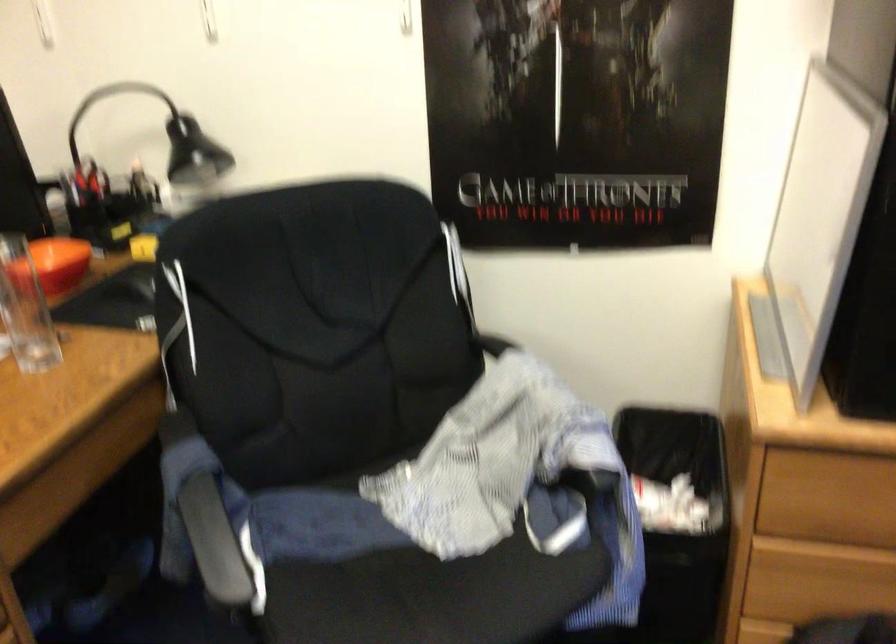
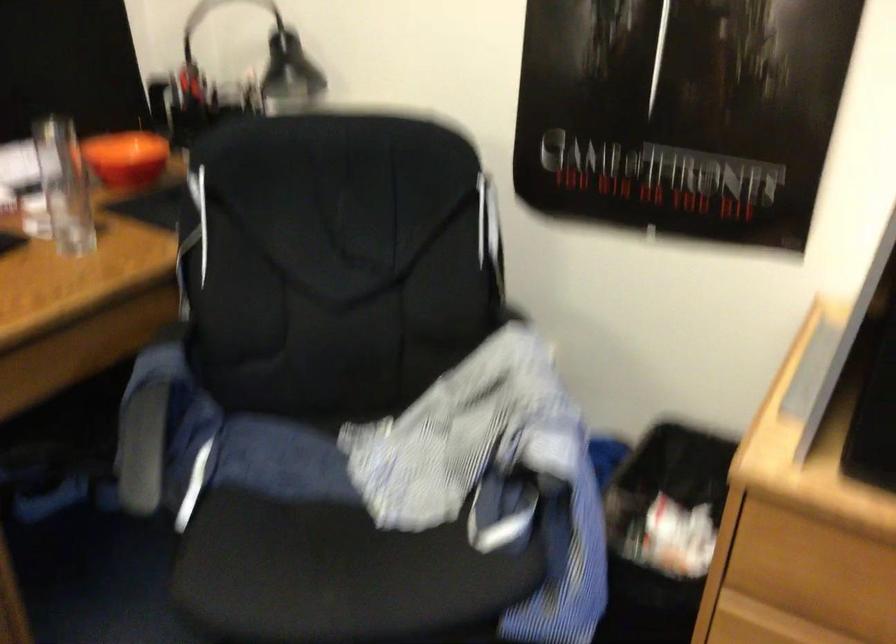
Where in the second image is the point corresponding to point (213, 545) from the first image?

(142, 448)